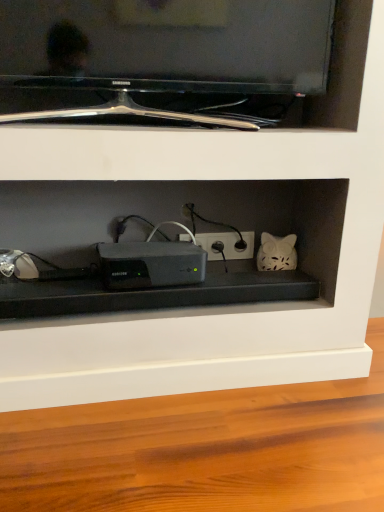
Question: Is white matte cat at center-right further to the viewer compared to white plastic electric outlet at center?

Choices:
 (A) no
 (B) yes

Answer: (A)

Question: Considering the relative positions of white matte cat at center-right and white plastic electric outlet at center in the image provided, is white matte cat at center-right to the left of white plastic electric outlet at center from the viewer's perspective?

Choices:
 (A) no
 (B) yes

Answer: (A)

Question: Can you see white matte cat at center-right touching white plastic electric outlet at center?

Choices:
 (A) no
 (B) yes

Answer: (A)

Question: From the image's perspective, is white matte cat at center-right beneath white plastic electric outlet at center?

Choices:
 (A) no
 (B) yes

Answer: (B)

Question: Would you say white matte cat at center-right contains white plastic electric outlet at center?

Choices:
 (A) no
 (B) yes

Answer: (A)

Question: From a real-world perspective, is white matte cat at center-right beneath white plastic electric outlet at center?

Choices:
 (A) no
 (B) yes

Answer: (A)

Question: Considering the relative sizes of white matte cat at center-right and black glossy tv at upper center in the image provided, is white matte cat at center-right wider than black glossy tv at upper center?

Choices:
 (A) no
 (B) yes

Answer: (A)

Question: Can you confirm if white matte cat at center-right is bigger than black glossy tv at upper center?

Choices:
 (A) no
 (B) yes

Answer: (A)

Question: Is white matte cat at center-right facing away from black glossy tv at upper center?

Choices:
 (A) yes
 (B) no

Answer: (B)

Question: Is white matte cat at center-right next to black glossy tv at upper center and touching it?

Choices:
 (A) no
 (B) yes

Answer: (A)

Question: Would you consider white matte cat at center-right to be distant from black glossy tv at upper center?

Choices:
 (A) yes
 (B) no

Answer: (B)

Question: Is white matte cat at center-right to the right of black glossy tv at upper center from the viewer's perspective?

Choices:
 (A) yes
 (B) no

Answer: (A)

Question: Is sleek black device at center not close to black glossy tv at upper center?

Choices:
 (A) yes
 (B) no

Answer: (B)